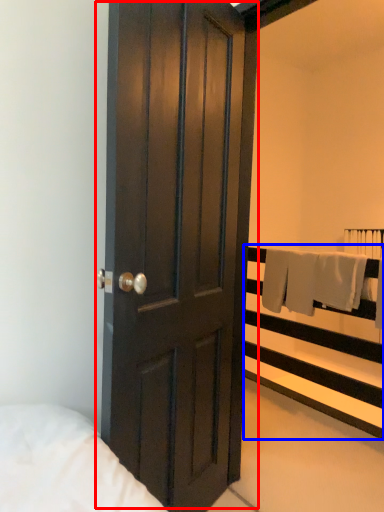
Question: Among these objects, which one is farthest to the camera, door (highlighted by a red box) or balustrade (highlighted by a blue box)?

Choices:
 (A) door
 (B) balustrade

Answer: (B)